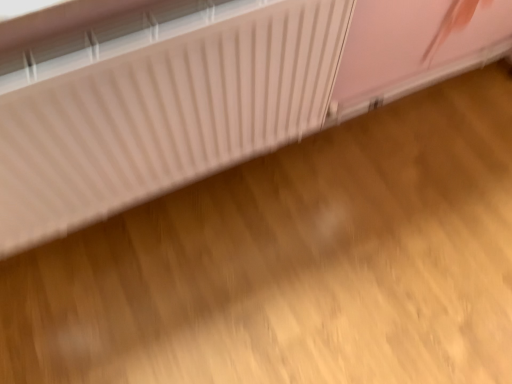
Find the location of a particular element. Image resolution: width=512 pixels, height=384 pixels. vacant region under white matte radiator at upper left (from a real-world perspective) is located at coordinates (281, 155).